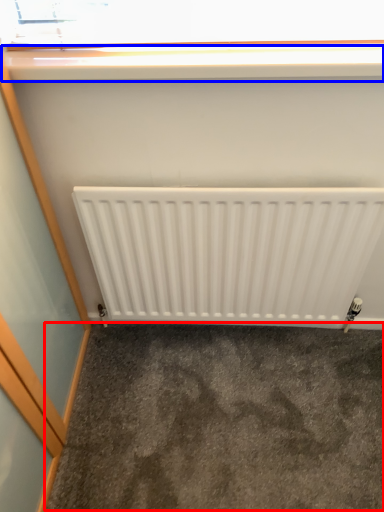
Question: Among these objects, which one is farthest to the camera, concrete (highlighted by a red box) or window sill (highlighted by a blue box)?

Choices:
 (A) concrete
 (B) window sill

Answer: (A)